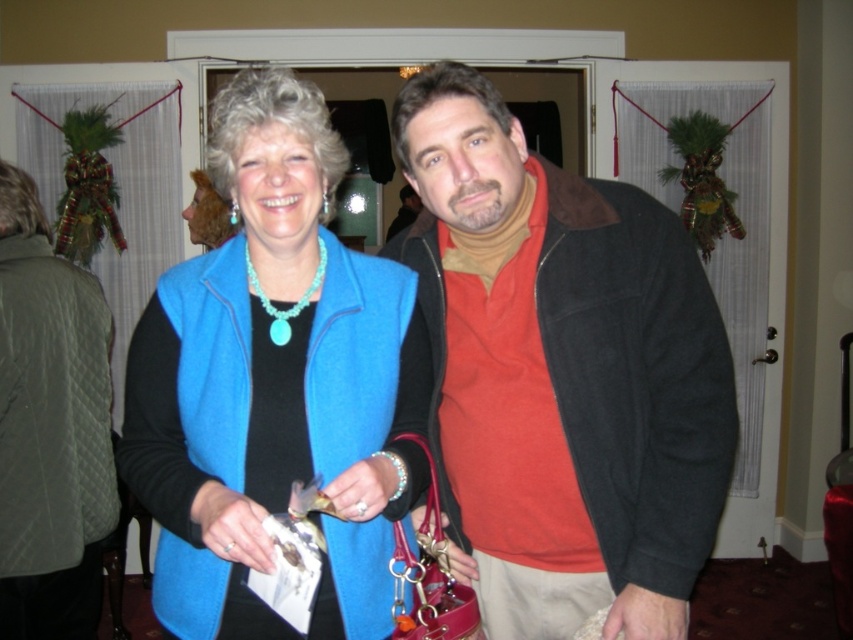
Which is below, matte black jacket at center or matte blue vest at center?

matte black jacket at center

Is matte black jacket at center to the right of matte blue vest at center from the viewer's perspective?

Indeed, matte black jacket at center is positioned on the right side of matte blue vest at center.

Is point (502, 438) positioned behind point (306, 164)?

Yes, it is.

At what (x,y) coordinates should I click in order to perform the action: click on matte black jacket at center. Please return your answer as a coordinate pair (x, y). Looking at the image, I should click on (561, 372).

Is point (560, 260) less distant than point (111, 344)?

Yes, point (560, 260) is in front of point (111, 344).

Can you confirm if matte black jacket at center is positioned below green quilted jacket at left?

Actually, matte black jacket at center is above green quilted jacket at left.

Describe the element at coordinates (561, 372) in the screenshot. Image resolution: width=853 pixels, height=640 pixels. I see `matte black jacket at center` at that location.

Locate an element on the screen. matte black jacket at center is located at coordinates (561, 372).

Who is higher up, matte blue vest at center or green quilted jacket at left?

matte blue vest at center

Which of these two, matte blue vest at center or green quilted jacket at left, stands shorter?

matte blue vest at center

Identify the location of matte blue vest at center. (274, 384).